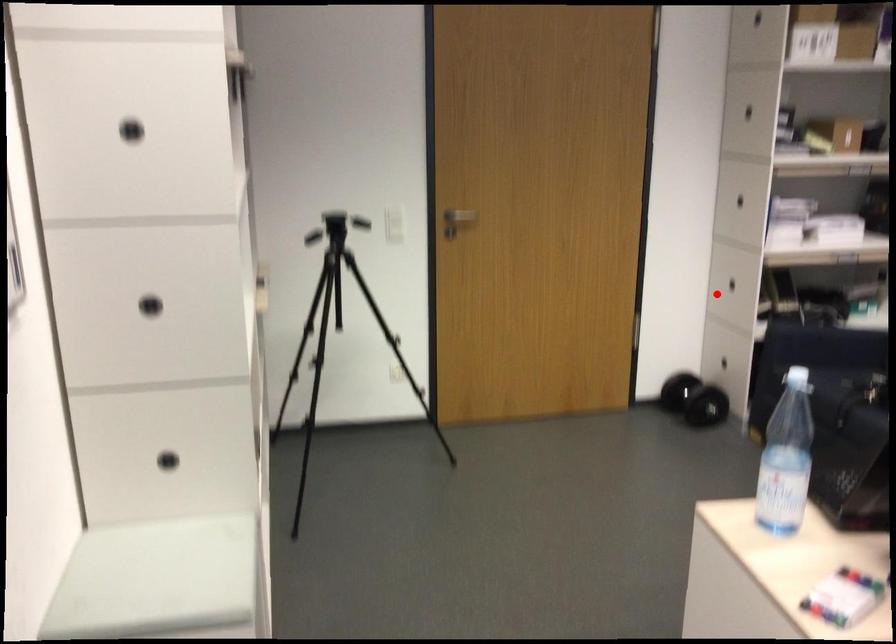
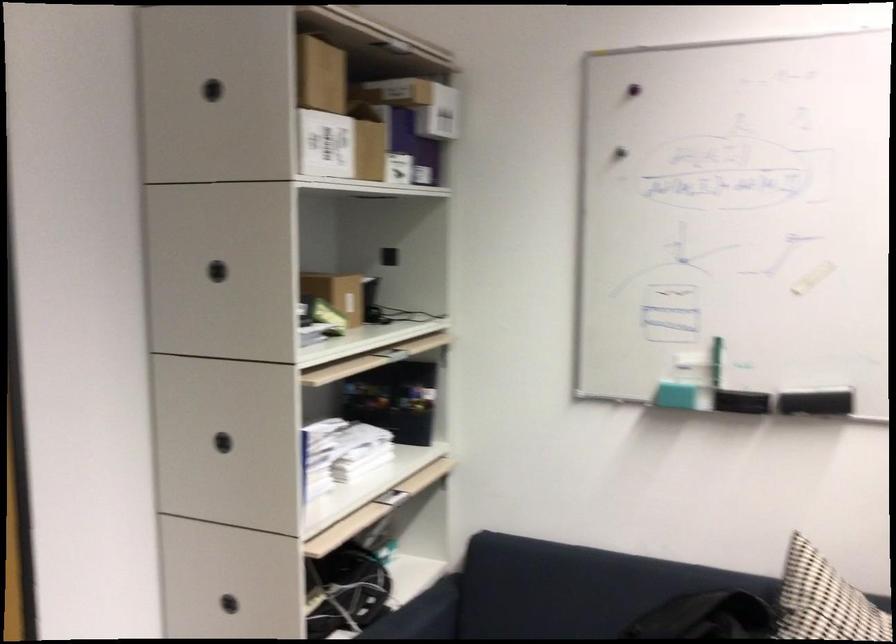
Question: I am providing you with two images of the same scene from different viewpoints. A red point is shown in image1. For the corresponding object point in image2, is it positioned nearer or farther from the camera?

Choices:
 (A) Nearer
 (B) Farther

Answer: (A)